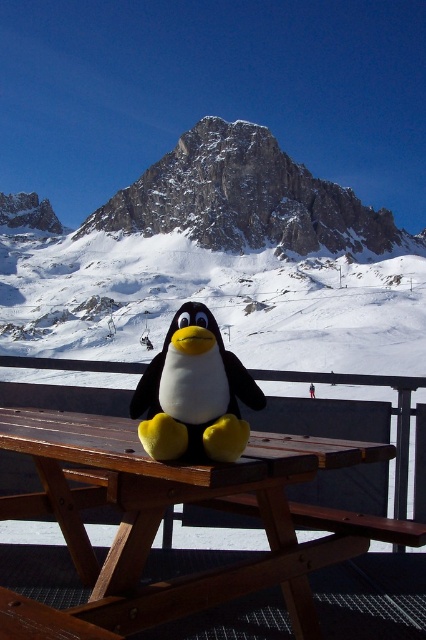
From the picture: Which is more to the left, snowy granite mountain at center or yellow plush penguin at center?

From the viewer's perspective, yellow plush penguin at center appears more on the left side.

Can you confirm if snowy granite mountain at center is smaller than yellow plush penguin at center?

Incorrect, snowy granite mountain at center is not smaller in size than yellow plush penguin at center.

I want to click on snowy granite mountain at center, so click(247, 198).

Does wooden picnic table at center appear over snowy granite mountain at center?

No, wooden picnic table at center is not above snowy granite mountain at center.

Is point (287, 557) less distant than point (299, 209)?

Yes, point (287, 557) is in front of point (299, 209).

Between point (85, 572) and point (348, 205), which one is positioned behind?

Positioned behind is point (348, 205).

I want to click on wooden picnic table at center, so click(x=161, y=516).

Can you confirm if wooden picnic table at center is bigger than yellow plush penguin at center?

Yes.

Is wooden picnic table at center positioned before yellow plush penguin at center?

Yes, wooden picnic table at center is in front of yellow plush penguin at center.

Between point (11, 611) and point (230, 365), which one is positioned in front?

Point (11, 611) is in front.

At what (x,y) coordinates should I click in order to perform the action: click on wooden picnic table at center. Please return your answer as a coordinate pair (x, y). Looking at the image, I should click on (161, 516).